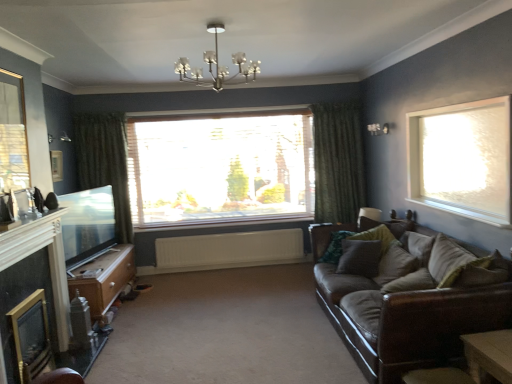
Question: Is velvet green pillow at right, the first pillow when ordered from front to back, positioned with its back to flat screen tv at left, marked as the first window screen in a back-to-front arrangement?

Choices:
 (A) no
 (B) yes

Answer: (A)

Question: From the image's perspective, is velvet green pillow at right, the first pillow when ordered from front to back, under flat screen tv at left, the second window screen in the top-to-bottom sequence?

Choices:
 (A) yes
 (B) no

Answer: (A)

Question: Is velvet green pillow at right, the first pillow when ordered from front to back, located outside flat screen tv at left, which appears as the 1th window screen when ordered from the bottom?

Choices:
 (A) yes
 (B) no

Answer: (A)

Question: Is velvet green pillow at right, which is counted as the fourth pillow, starting from the back, oriented towards flat screen tv at left, marked as the first window screen in a back-to-front arrangement?

Choices:
 (A) no
 (B) yes

Answer: (B)

Question: Does velvet green pillow at right, the first pillow when ordered from front to back, have a greater width compared to flat screen tv at left, the second window screen in the top-to-bottom sequence?

Choices:
 (A) no
 (B) yes

Answer: (B)

Question: In the image, is velvet green pillow at right, which is counted as the fourth pillow, starting from the back, positioned in front of or behind flat screen tv at left, which appears as the 1th window screen when ordered from the bottom?

Choices:
 (A) behind
 (B) front

Answer: (B)

Question: Looking at their shapes, would you say velvet green pillow at right, which is counted as the fourth pillow, starting from the back, is wider or thinner than flat screen tv at left, marked as the first window screen in a back-to-front arrangement?

Choices:
 (A) wide
 (B) thin

Answer: (A)

Question: Is point (466, 251) closer or farther from the camera than point (72, 228)?

Choices:
 (A) closer
 (B) farther

Answer: (A)

Question: From the image's perspective, is velvet green pillow at right, which is counted as the fourth pillow, starting from the back, located above or below flat screen tv at left, marked as the first window screen in a back-to-front arrangement?

Choices:
 (A) below
 (B) above

Answer: (A)

Question: Would you say beige fabric pillow at right, marked as the second pillow in a front-to-back arrangement, is to the left or to the right of wooden picture frame at upper left in the picture?

Choices:
 (A) right
 (B) left

Answer: (A)

Question: Is beige fabric pillow at right, which is the 3th pillow in back-to-front order, inside the boundaries of wooden picture frame at upper left, or outside?

Choices:
 (A) outside
 (B) inside

Answer: (A)

Question: From the image's perspective, is beige fabric pillow at right, marked as the second pillow in a front-to-back arrangement, above or below wooden picture frame at upper left?

Choices:
 (A) above
 (B) below

Answer: (B)

Question: Considering the positions of beige fabric pillow at right, marked as the second pillow in a front-to-back arrangement, and wooden picture frame at upper left in the image, is beige fabric pillow at right, marked as the second pillow in a front-to-back arrangement, taller or shorter than wooden picture frame at upper left?

Choices:
 (A) short
 (B) tall

Answer: (B)

Question: Visually, is green textured curtain at left, which is the first curtain in left-to-right order, positioned to the left or to the right of brown leather couch at right?

Choices:
 (A) left
 (B) right

Answer: (A)

Question: Considering the positions of green textured curtain at left, placed as the 2th curtain when sorted from right to left, and brown leather couch at right in the image, is green textured curtain at left, placed as the 2th curtain when sorted from right to left, wider or thinner than brown leather couch at right?

Choices:
 (A) wide
 (B) thin

Answer: (B)